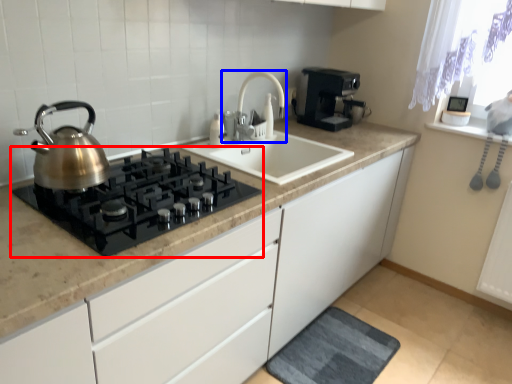
Question: Which object appears closest to the camera in this image, gas stove (highlighted by a red box) or tap (highlighted by a blue box)?

Choices:
 (A) gas stove
 (B) tap

Answer: (A)